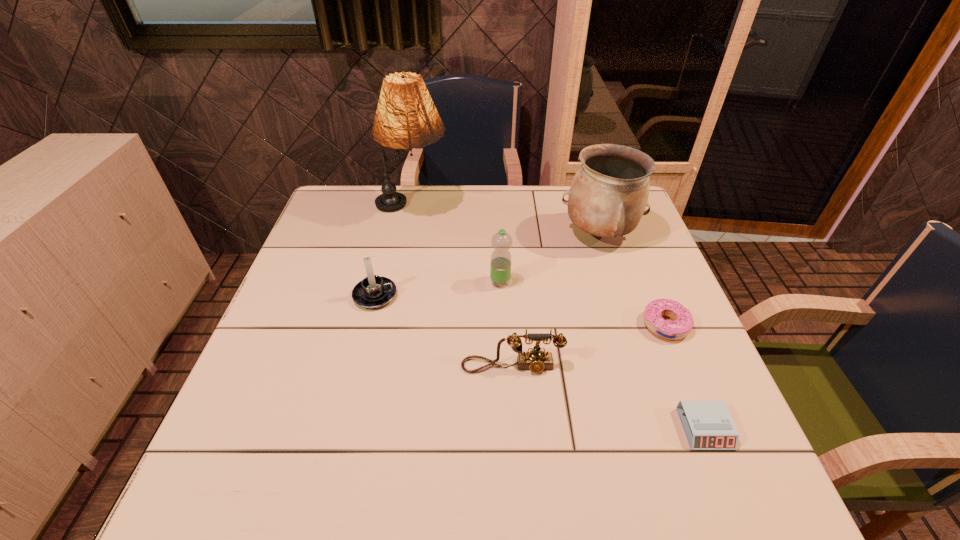
Locate an element on the screen. The image size is (960, 540). doughnut present at the right edge is located at coordinates (683, 322).

The image size is (960, 540). I want to click on alarm clock located in the right edge section of the desktop, so click(x=708, y=425).

The image size is (960, 540). In order to click on object located in the far left corner section of the desktop in this screenshot , I will do `click(406, 117)`.

This screenshot has height=540, width=960. Identify the location of object located at the far right corner. (609, 193).

What are the coordinates of `vacant space at the far edge of the desktop` in the screenshot? It's located at click(x=546, y=202).

In the image, there is a desktop. Where is `vacant space at the near edge`? Image resolution: width=960 pixels, height=540 pixels. vacant space at the near edge is located at coordinates (468, 482).

Identify the location of vacant area at the left edge. The height and width of the screenshot is (540, 960). (308, 291).

In the image, there is a desktop. At what (x,y) coordinates should I click in order to perform the action: click on free space at the right edge. Please return your answer as a coordinate pair (x, y). The width and height of the screenshot is (960, 540). Looking at the image, I should click on (651, 269).

Where is `free space at the far left corner of the desktop`? The height and width of the screenshot is (540, 960). free space at the far left corner of the desktop is located at coordinates (348, 193).

Where is `free space between the nearest object and the tallest object`? free space between the nearest object and the tallest object is located at coordinates (559, 319).